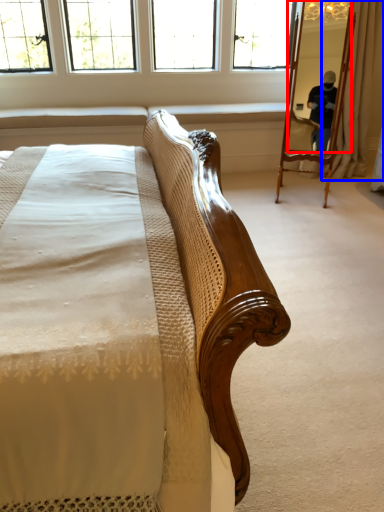
Question: Which object appears closest to the camera in this image, mirror (highlighted by a red box) or curtain (highlighted by a blue box)?

Choices:
 (A) mirror
 (B) curtain

Answer: (A)